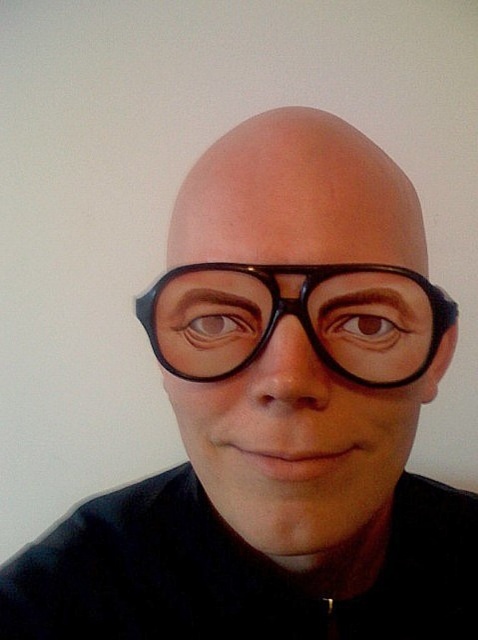
Is black matte glasses at center shorter than black plastic glasses at center?

No, black matte glasses at center is not shorter than black plastic glasses at center.

Does black matte glasses at center have a greater height compared to black plastic glasses at center?

Correct, black matte glasses at center is much taller as black plastic glasses at center.

Describe the element at coordinates (297, 444) in the screenshot. This screenshot has width=478, height=640. I see `black matte glasses at center` at that location.

This screenshot has height=640, width=478. I want to click on black matte glasses at center, so click(297, 444).